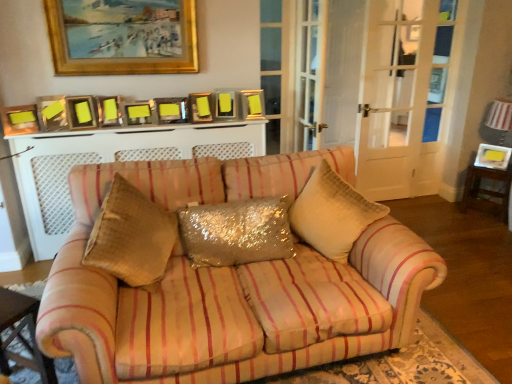
The width and height of the screenshot is (512, 384). Find the location of `free point below wooden table at right, positioned as the second table in bottom-to-top order (from a real-world perspective)`. free point below wooden table at right, positioned as the second table in bottom-to-top order (from a real-world perspective) is located at coordinates (484, 213).